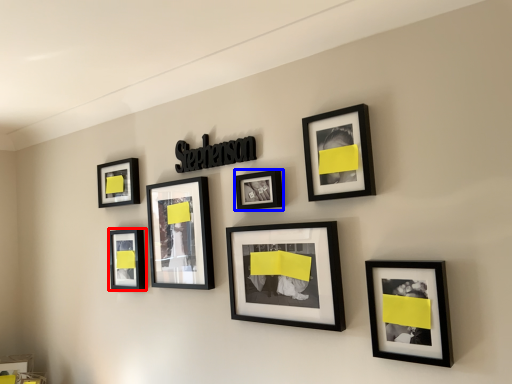
Question: Which object is closer to the camera taking this photo, picture frame (highlighted by a red box) or picture frame (highlighted by a blue box)?

Choices:
 (A) picture frame
 (B) picture frame

Answer: (B)